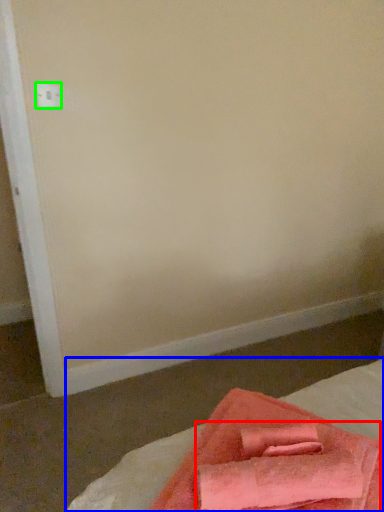
Question: Based on their relative distances, which object is farther from bath towel (highlighted by a red box)? Choose from bed (highlighted by a blue box) and electric outlet (highlighted by a green box).

Choices:
 (A) bed
 (B) electric outlet

Answer: (B)